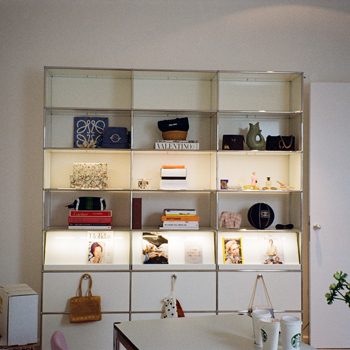
I want to click on starbucks cup, so click(288, 329).